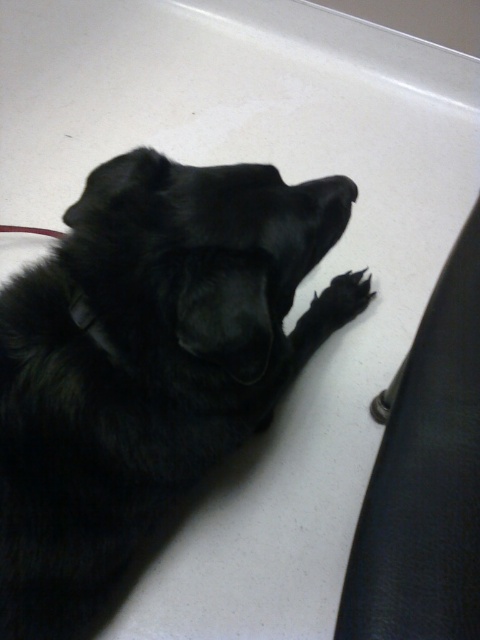
Question: Is black fluffy dog at center further to the viewer compared to black fur paw at lower right?

Choices:
 (A) yes
 (B) no

Answer: (B)

Question: Which point is farther from the camera taking this photo?

Choices:
 (A) coord(325,305)
 (B) coord(240,227)

Answer: (A)

Question: Where is black fluffy dog at center located in relation to black fur paw at lower right in the image?

Choices:
 (A) above
 (B) below

Answer: (B)

Question: Is black fluffy dog at center smaller than black fur paw at lower right?

Choices:
 (A) no
 (B) yes

Answer: (A)

Question: Which object appears farthest from the camera in this image?

Choices:
 (A) black fur paw at lower right
 (B) black fluffy dog at center

Answer: (A)